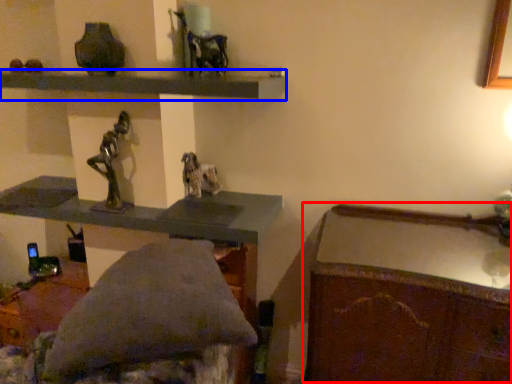
Question: Which object is closer to the camera taking this photo, writing desk (highlighted by a red box) or shelf (highlighted by a blue box)?

Choices:
 (A) writing desk
 (B) shelf

Answer: (A)